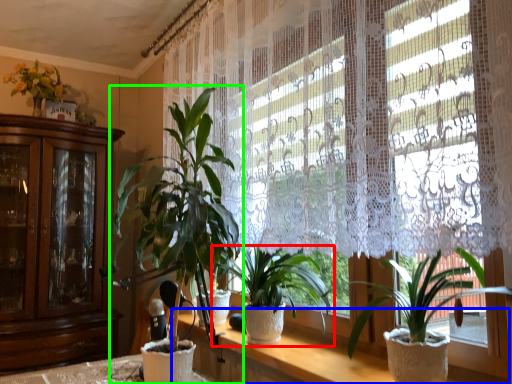
Question: Which object is the closest to the houseplant (highlighted by a red box)? Choose among these: vanity (highlighted by a blue box) or houseplant (highlighted by a green box).

Choices:
 (A) vanity
 (B) houseplant

Answer: (A)